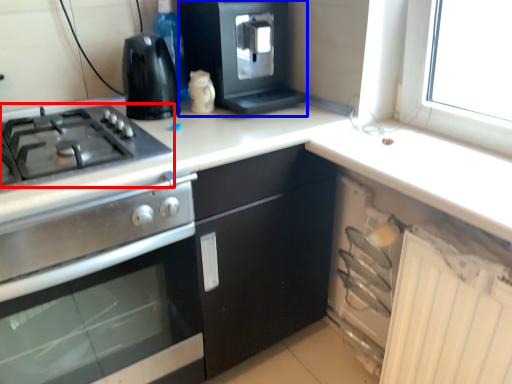
Question: Which object appears closest to the camera in this image, gas stove (highlighted by a red box) or kitchen appliance (highlighted by a blue box)?

Choices:
 (A) gas stove
 (B) kitchen appliance

Answer: (A)